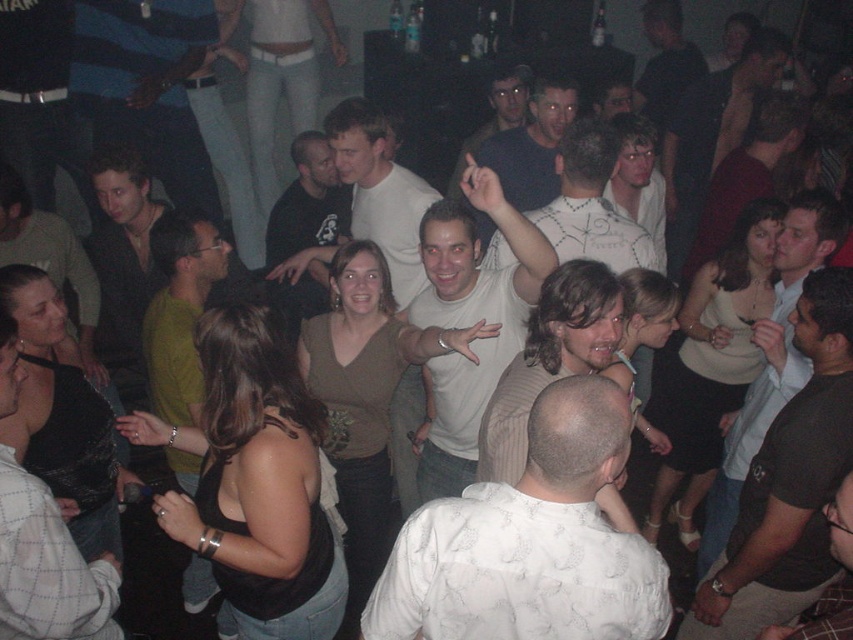
You are a photographer at the nightclub and need to capture a photo of both the white dotted shirt at center and the matte white shirt at center. Which shirt should you focus on first to ensure it appears larger in the photo?

The matte white shirt at center should be focused on first because it is larger in size compared to the white dotted shirt at center, ensuring it appears larger in the photo.

You are at a party and want to find someone wearing a white textured shirt at center. According to the coordinates provided, where exactly would you look in the image?

The white textured shirt at center is located at point (531, 541), so you should look towards the upper right area of the image since the coordinates are closer to 1 on both axes.

You are standing in the nightclub and want to move to the location marked by the point at coordinates point (260,312). Considering your height is 1.7 meters, will you be able to comfortably walk there without bumping your head?

The point (260,312) is 2.24 meters away from you. Since the height of the space isn not mentioned, but your height is 1.7 meters, it is likely safe to walk there as long as the ceiling height is standard. However, the given information only specifies the distance, not the height clearance. Without information about the ceiling height at that point, we can only confirm the distance is manageable.